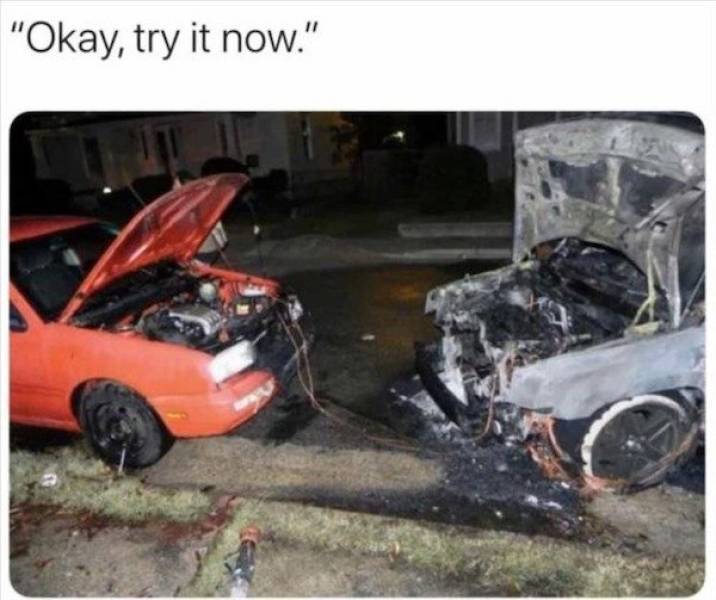
Where is `white light in background`? white light in background is located at coordinates (399, 134).